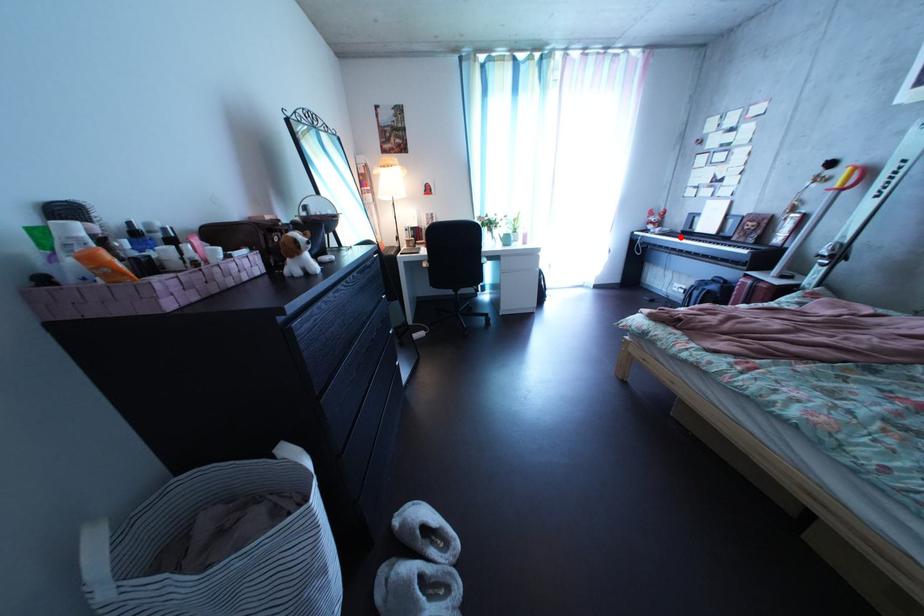
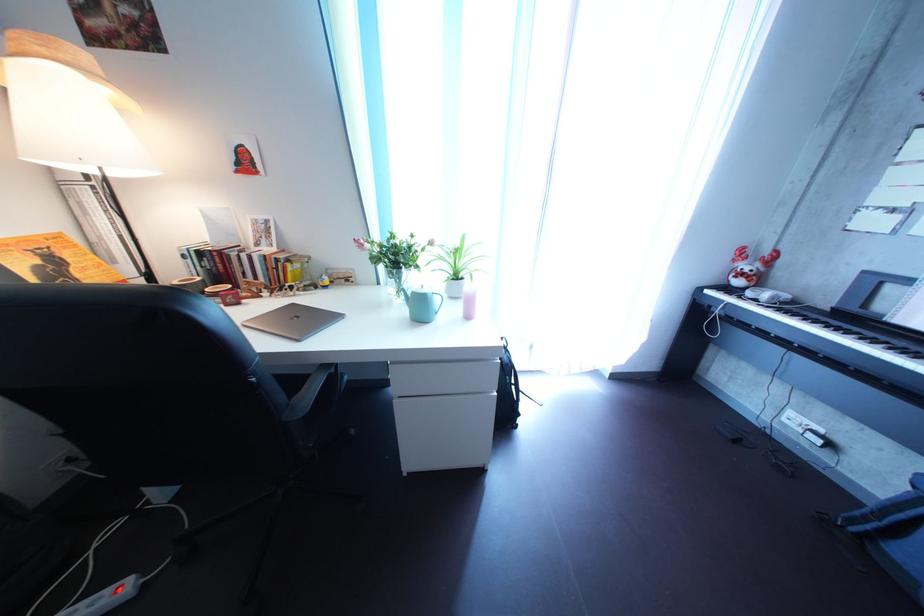
Question: I am providing you with two images of the same scene from different viewpoints. Image1 has a red point marked. In image2, the corresponding 3D location appears at what relative position? Reply with the corresponding letter.

Choices:
 (A) Closer
 (B) Farther

Answer: (B)